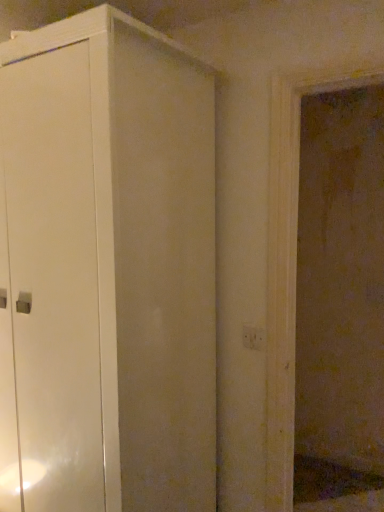
This screenshot has height=512, width=384. In order to click on white plastic electric outlet at center-right in this screenshot , I will do `click(253, 338)`.

Describe the element at coordinates (253, 338) in the screenshot. The image size is (384, 512). I see `white plastic electric outlet at center-right` at that location.

In order to face white plastic electric outlet at center-right, should I rotate leftwards or rightwards?

Rotate your view right by about 8.145°.

Where is `white plastic electric outlet at center-right`? white plastic electric outlet at center-right is located at coordinates (253, 338).